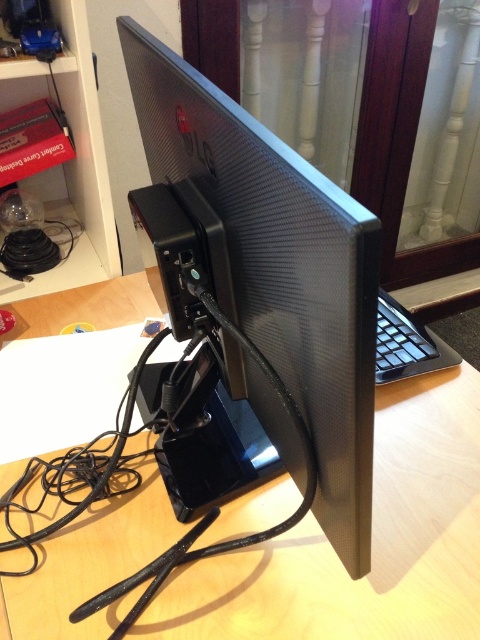
Question: Which point is farther to the camera?

Choices:
 (A) satin black monitor at center
 (B) wooden computer desk at center

Answer: (B)

Question: Can you confirm if wooden computer desk at center is smaller than satin black monitor at center?

Choices:
 (A) yes
 (B) no

Answer: (B)

Question: Which point is closer to the camera?

Choices:
 (A) (338, 260)
 (B) (457, 568)

Answer: (A)

Question: Can you confirm if wooden computer desk at center is positioned above satin black monitor at center?

Choices:
 (A) yes
 (B) no

Answer: (B)

Question: Can you confirm if wooden computer desk at center is thinner than satin black monitor at center?

Choices:
 (A) no
 (B) yes

Answer: (A)